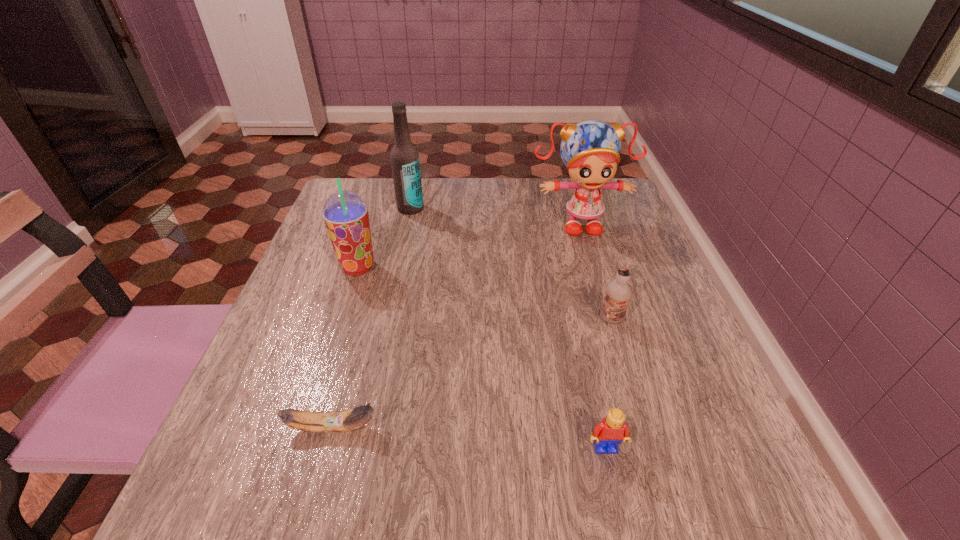
Find the location of `chocolate milk located at the right edge`. chocolate milk located at the right edge is located at coordinates (619, 292).

You are a GUI agent. You are given a task and a screenshot of the screen. Output one action in this format:
    pyautogui.click(x=<x>, y=<y>)
    Task: Click on the object that is at the far right corner
    
    Given the screenshot: What is the action you would take?
    pyautogui.click(x=590, y=150)

Find the location of a particular element. free space at the far edge is located at coordinates (493, 226).

The height and width of the screenshot is (540, 960). In the image, there is a desktop. In order to click on free space at the near edge in this screenshot , I will do `click(381, 481)`.

Identify the location of vacant space at the left edge of the desktop. This screenshot has width=960, height=540. (360, 319).

I want to click on free location at the right edge of the desktop, so click(x=620, y=241).

I want to click on free location at the far left corner of the desktop, so click(385, 179).

The height and width of the screenshot is (540, 960). Find the location of `vacant region at the near left corner of the desktop`. vacant region at the near left corner of the desktop is located at coordinates (272, 507).

The width and height of the screenshot is (960, 540). I want to click on vacant space at the near right corner of the desktop, so click(x=730, y=477).

Locate an element on the screen. This screenshot has width=960, height=540. unoccupied area between the beer bottle and the doll is located at coordinates (494, 215).